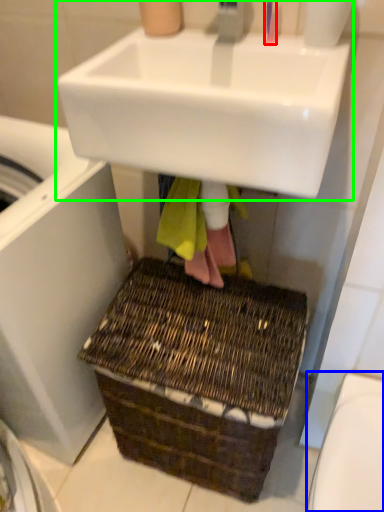
Question: Which object is positioned closest to toothbrush (highlighted by a red box)? Select from toilet bowl (highlighted by a blue box) and sink (highlighted by a green box).

Choices:
 (A) toilet bowl
 (B) sink

Answer: (B)